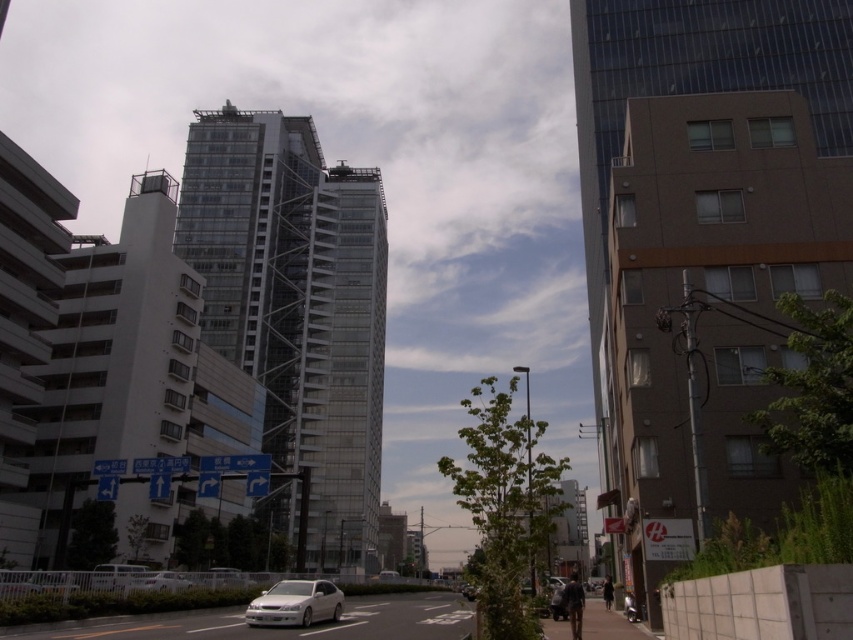
Based on the photo, is transparent glass building at center bigger than white glossy sedan at center?

Correct, transparent glass building at center is larger in size than white glossy sedan at center.

Does point (347, 284) come behind point (341, 608)?

Yes.

Is point (280, 340) closer to viewer compared to point (291, 579)?

No, (280, 340) is behind (291, 579).

Locate an element on the screen. transparent glass building at center is located at coordinates (296, 308).

Is glassy reflective tower at center behind white glossy sedan at center?

No, it is not.

Is glassy reflective tower at center shorter than white glossy sedan at center?

No, glassy reflective tower at center is not shorter than white glossy sedan at center.

Locate an element on the screen. The image size is (853, 640). glassy reflective tower at center is located at coordinates (700, 196).

Who is shorter, glassy reflective tower at center or transparent glass building at center?

With less height is glassy reflective tower at center.

Does glassy reflective tower at center have a larger size compared to transparent glass building at center?

Actually, glassy reflective tower at center might be smaller than transparent glass building at center.

What do you see at coordinates (700, 196) in the screenshot? The height and width of the screenshot is (640, 853). I see `glassy reflective tower at center` at bounding box center [700, 196].

This screenshot has height=640, width=853. In order to click on glassy reflective tower at center in this screenshot , I will do `click(700, 196)`.